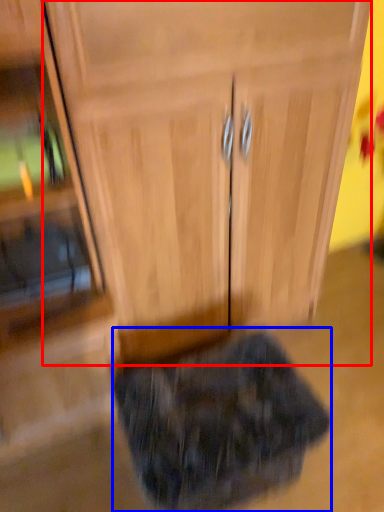
Question: Among these objects, which one is nearest to the camera, cabinetry (highlighted by a red box) or animal (highlighted by a blue box)?

Choices:
 (A) cabinetry
 (B) animal

Answer: (A)